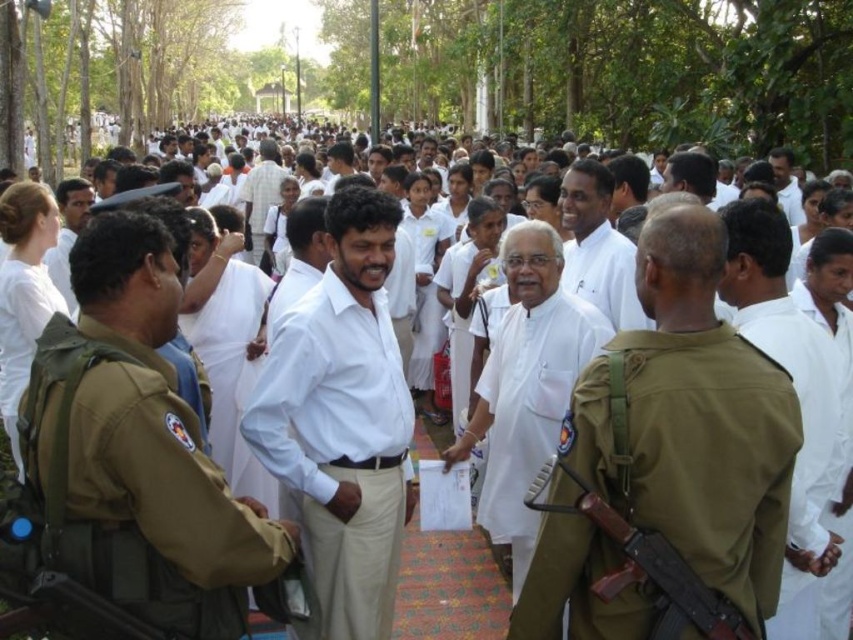
Question: Estimate the real-world distances between objects in this image. Which object is farther from the white cloth shirt at center?

Choices:
 (A) white matte shirt at center
 (B) wooden brown rifle at center
 (C) white cloth at center
 (D) brown uniform at left

Answer: (D)

Question: Is white matte shirt at center to the right of brown uniform at left from the viewer's perspective?

Choices:
 (A) no
 (B) yes

Answer: (B)

Question: Which point appears closest to the camera in this image?

Choices:
 (A) (788, 212)
 (B) (740, 330)

Answer: (B)

Question: Considering the relative positions of brown uniform at left and white cotton shirt at center in the image provided, where is brown uniform at left located with respect to white cotton shirt at center?

Choices:
 (A) above
 (B) below

Answer: (A)

Question: Which point is closer to the camera?

Choices:
 (A) 596,285
 (B) 785,157
 (C) 521,556

Answer: (C)

Question: Is white matte shirt at center below white cloth shirt at center?

Choices:
 (A) yes
 (B) no

Answer: (A)